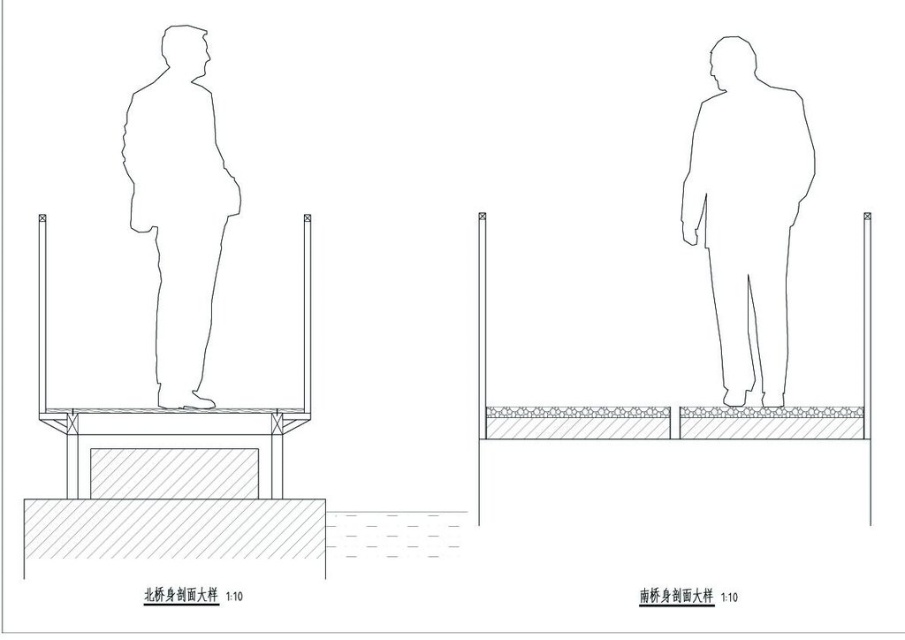
Is white matte figure at center to the left of white paper man at center from the viewer's perspective?

No, white matte figure at center is not to the left of white paper man at center.

Between white matte figure at center and white paper man at center, which one has more height?

Standing taller between the two is white paper man at center.

Describe the element at coordinates (746, 211) in the screenshot. I see `white matte figure at center` at that location.

The image size is (905, 640). Find the location of `white matte figure at center`. white matte figure at center is located at coordinates (746, 211).